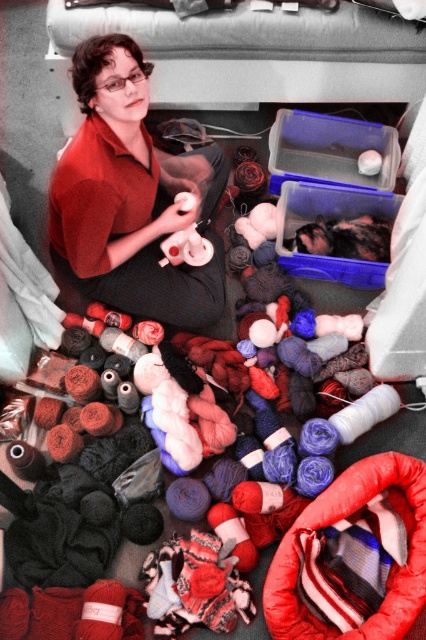
You are standing in the craft room and need to find the matte red shirt at center. According to the coordinates provided, where exactly is it positioned?

The matte red shirt at center is located at point coordinates of (x=131, y=196).

You are organizing a craft fair booth and need to place the matte red shirt at center and the transparent plastic container at center on a shelf. The shelf has a width of 1 meter. Can both items fit side by side without overlapping?

The matte red shirt at center is larger in size than the transparent plastic container at center, but the combined size of both items is not specified. Therefore, it is uncertain if they can fit side by side on the 1 meter shelf without overlapping.

You are organizing a craft room and need to place a new box between the transparent plastic container at center and the translucent plastic container at center. Which container should you place the new box next to based on their positions?

The transparent plastic container at center is to the right of the translucent plastic container at center, so you should place the new box to the right of the translucent plastic container at center or to the left of the transparent plastic container at center to position it between them.